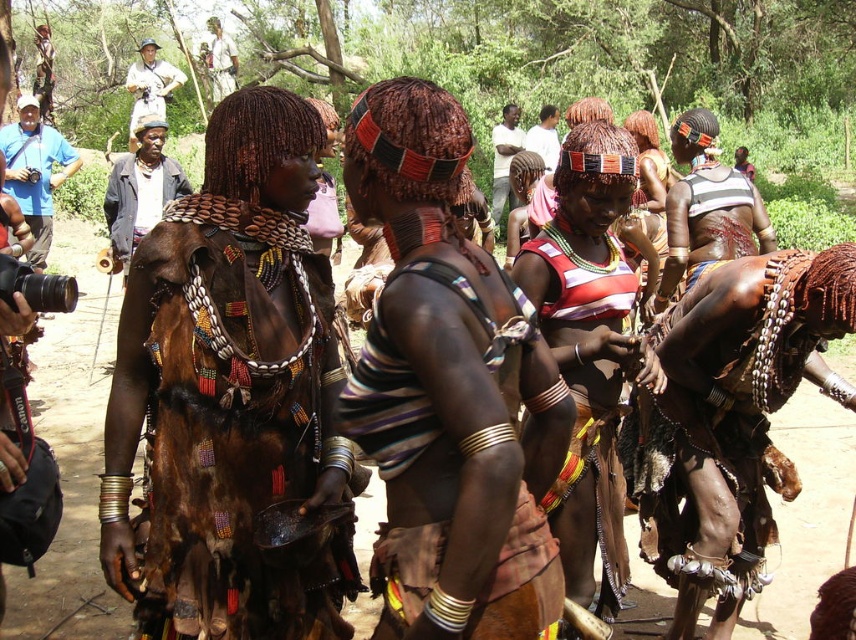
You are a photographer standing at the camera position. You want to take a closeup shot of the striped fabric top at center. The camera has a maximum zoom range of 3 meters. Can you get a closeup without moving closer?

The distance between the striped fabric top at center and the camera is 4.07 meters, which exceeds the camera maximum zoom range of 3 meters. Therefore, you cannot get a closeup without moving closer.

You are standing in front of the scene and want to take a photo. There are two points in the image, point 1 at coordinates point (682, 260) and point 2 at coordinates point (153, 93). Which point is closer to you?

Point (682, 260) is closer to the camera than point (153, 93), so point 1 is closer to you.